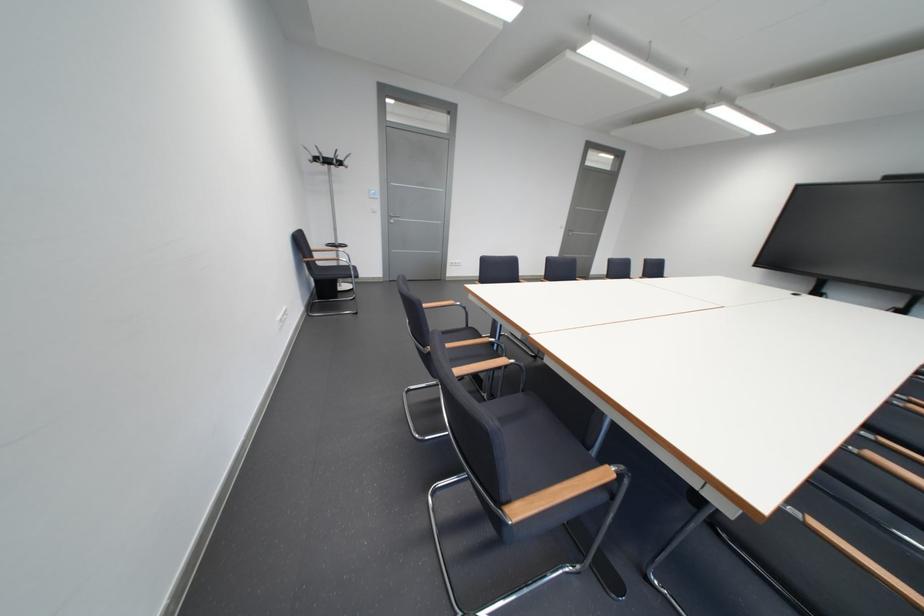
Describe the element at coordinates (556, 493) in the screenshot. This screenshot has width=924, height=616. I see `the wooden chair armrest` at that location.